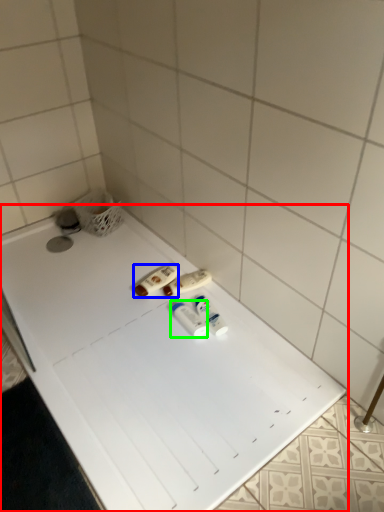
Question: Which object is positioned closest to bathtub (highlighted by a red box)? Select from toiletry (highlighted by a blue box) and toiletry (highlighted by a green box).

Choices:
 (A) toiletry
 (B) toiletry

Answer: (B)